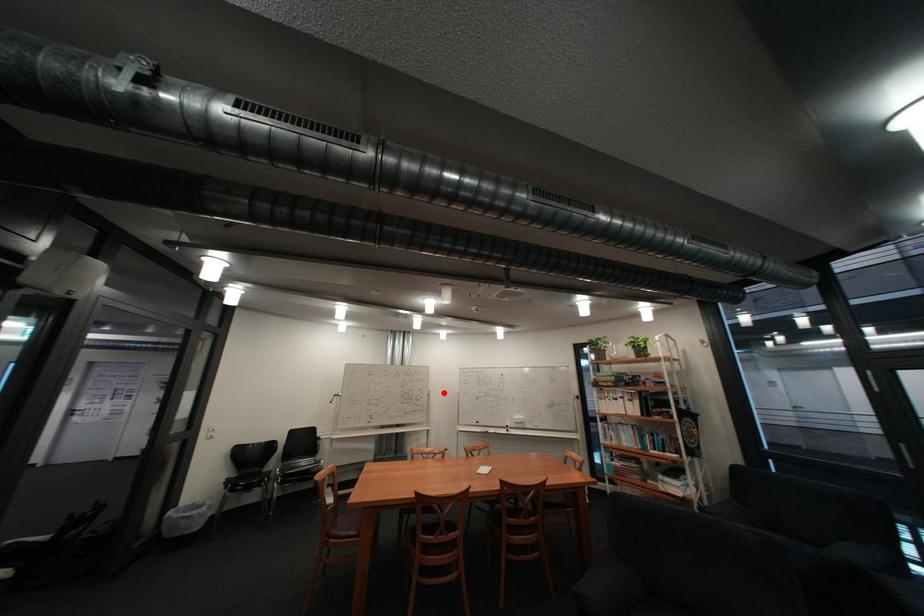
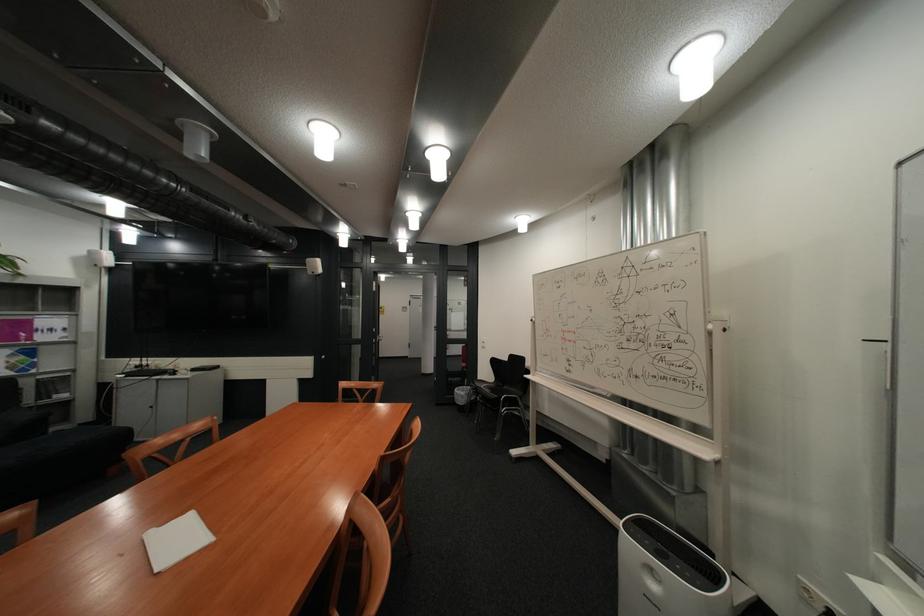
Find the pixel in the second image that matches the highlighted location in the first image.

(725, 326)